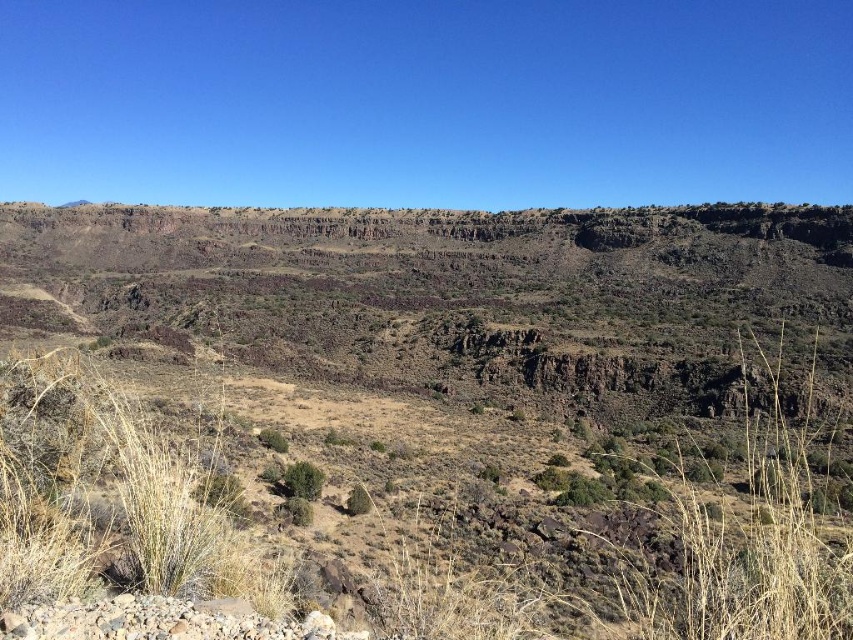
You are a hiker standing at the point marked as point (492,308) in the image. You want to reach the brown rocky cliffs at upper center. Which direction should you go from your current position?

The point (492,308) is located at the brown rocky cliffs at upper center, so you are already there.

You are a hiker trying to navigate through this arid landscape. You need to pass between the brown rocky cliffs at upper center and the green leafy bush at center. Can you estimate if there is enough space for you to walk through comfortably?

The brown rocky cliffs at upper center might be wider than the green leafy bush at center, so there might be sufficient space for you to walk through comfortably.

You are a hiker who wants to cross the desert. You see the brown rocky cliffs at upper center and the green leafy bush at center. Which object is farther away from you?

The brown rocky cliffs at upper center are farther away from you since they are 96.03 meters away from the green leafy bush at center, which is closer to your position.